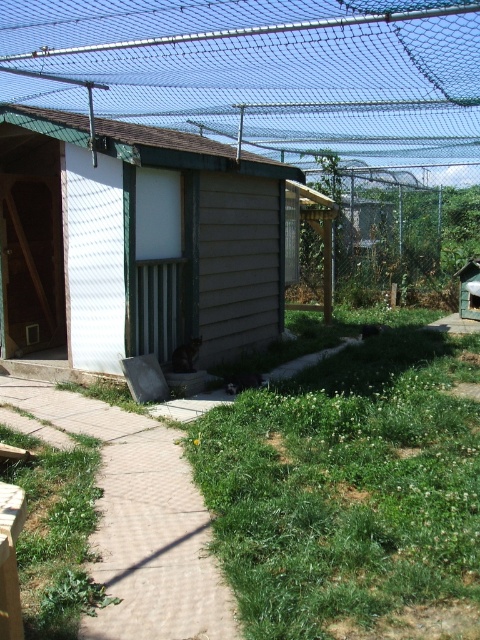
Question: Which object is closer to the camera taking this photo?

Choices:
 (A) brown wood cabin at center
 (B) green mesh fence at upper center
 (C) green grass at lower right

Answer: (C)

Question: In this image, where is green grass at lower right located relative to brown brick path at lower left?

Choices:
 (A) right
 (B) left

Answer: (A)

Question: Is green mesh fence at upper center wider than brown wood cabin at center?

Choices:
 (A) no
 (B) yes

Answer: (A)

Question: Can you confirm if brown wood cabin at center is positioned to the right of brown brick path at lower left?

Choices:
 (A) no
 (B) yes

Answer: (A)

Question: Which point is farther to the camera?

Choices:
 (A) (300, 556)
 (B) (200, 289)

Answer: (B)

Question: Based on their relative distances, which object is farther from the green mesh fence at upper center?

Choices:
 (A) brown wood cabin at center
 (B) brown brick path at lower left
 (C) green grass at lower right

Answer: (B)